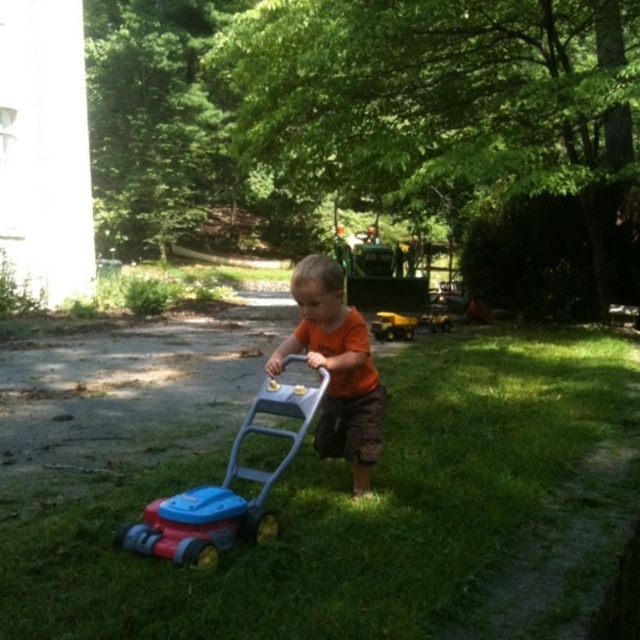
Question: Among these points, which one is farthest from the camera?

Choices:
 (A) (342, 323)
 (B) (301, 397)
 (C) (392, 320)

Answer: (C)

Question: Does orange matte shirt at center have a larger size compared to yellow plastic tractor at center?

Choices:
 (A) no
 (B) yes

Answer: (B)

Question: Which point appears farthest from the camera in this image?

Choices:
 (A) (408, 326)
 (B) (84, 515)
 (C) (337, 276)
 (D) (285, 394)

Answer: (A)

Question: Does green grass at center appear on the left side of orange matte shirt at center?

Choices:
 (A) yes
 (B) no

Answer: (B)

Question: Which of the following is the closest to the observer?

Choices:
 (A) (312, 333)
 (B) (412, 330)

Answer: (A)

Question: Does orange matte shirt at center appear on the right side of yellow plastic tractor at center?

Choices:
 (A) yes
 (B) no

Answer: (B)